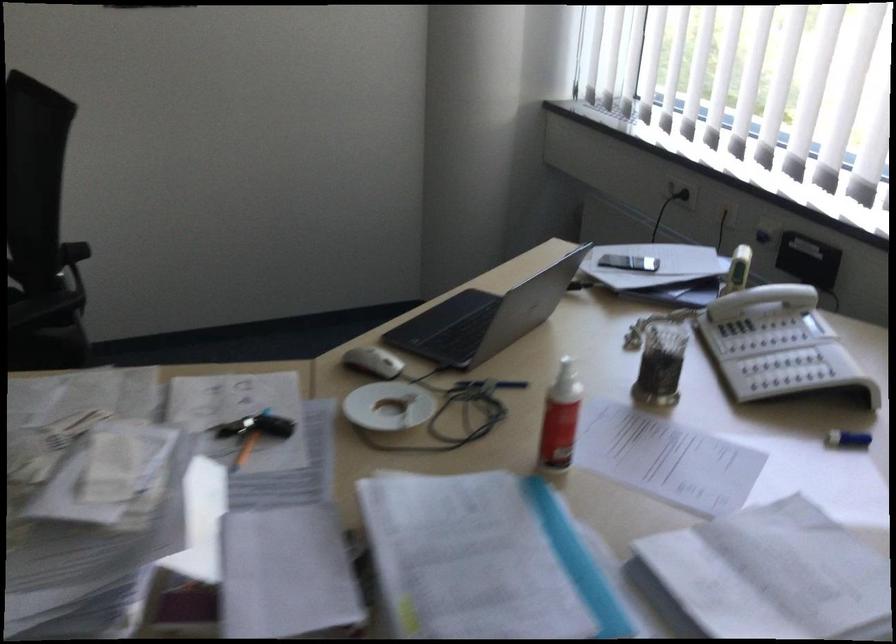
At what (x,y) coordinates should I click in order to perform the action: click on white tape roll. Please return your answer as a coordinate pair (x, y). Looking at the image, I should click on (394, 413).